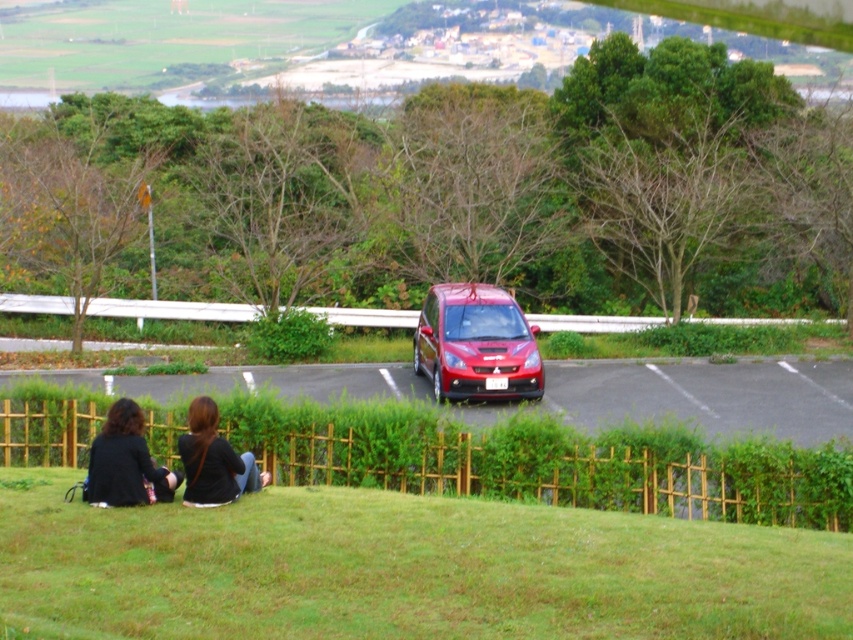
You are a photographer setting up a tripod in the parking lot. You need to position your camera so that both the glossy red car at center and the black fabric jacket at lower left are visible in the frame. Given their sizes, which object will appear larger in your photo?

The glossy red car at center will appear larger in the photo because it is bigger than the black fabric jacket at lower left.

You are standing in the parking lot and want to take a photo of both the green bamboo fence at lower center and the glossy red car at center. Which object should you position closer to the camera to ensure both are in focus?

To ensure both the green bamboo fence at lower center and the glossy red car at center are in focus, position the camera closer to the green bamboo fence at lower center since it is nearer to the viewer than the glossy red car at center.

You are a landscape designer planning to install a new pathway between the green leafy hedge at center and the green grassy hillside at lower center. Which object should the pathway be closer to in order to avoid blocking the view of the taller one?

The pathway should be closer to the green grassy hillside at lower center because the green leafy hedge at center is taller than the green grassy hillside at lower center, so keeping the pathway near the shorter object will maintain the view of the taller hedge.